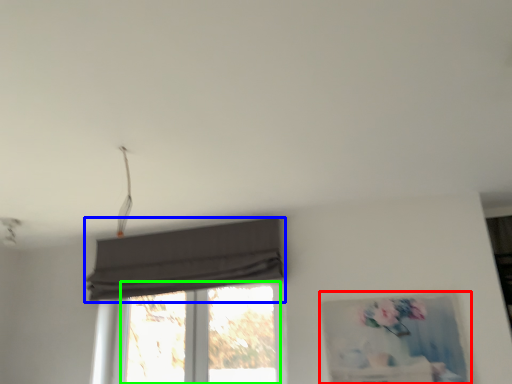
Question: Which object is the closest to the picture frame (highlighted by a red box)? Choose among these: curtain (highlighted by a blue box) or window (highlighted by a green box).

Choices:
 (A) curtain
 (B) window

Answer: (B)